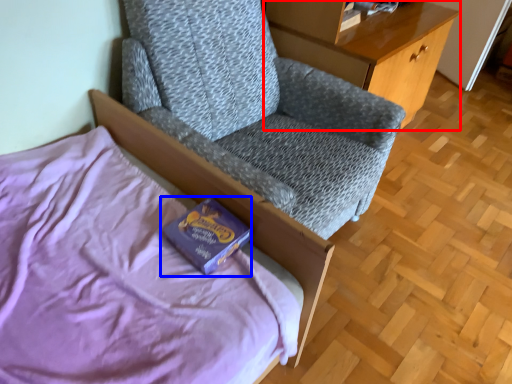
Question: Which point is closer to the camera, desk (highlighted by a red box) or paperback book (highlighted by a blue box)?

Choices:
 (A) desk
 (B) paperback book

Answer: (B)